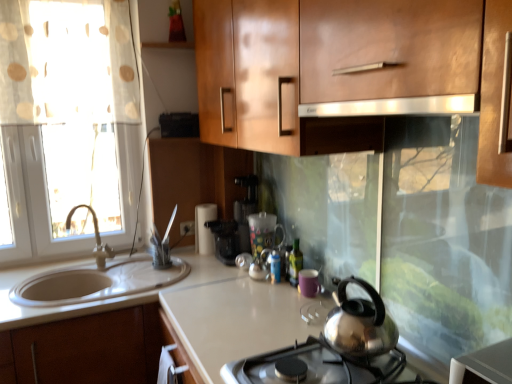
Question: Does matte silver faucet at left have a greater height compared to purple matte mug at center, the 1th appliance viewed from the front?

Choices:
 (A) no
 (B) yes

Answer: (B)

Question: Is matte silver faucet at left smaller than purple matte mug at center, the 1th appliance viewed from the front?

Choices:
 (A) yes
 (B) no

Answer: (B)

Question: Is matte silver faucet at left positioned with its back to purple matte mug at center, placed as the 1th appliance when sorted from right to left?

Choices:
 (A) no
 (B) yes

Answer: (A)

Question: Considering the relative sizes of matte silver faucet at left and purple matte mug at center, the third appliance from the back, in the image provided, is matte silver faucet at left thinner than purple matte mug at center, the third appliance from the back,?

Choices:
 (A) yes
 (B) no

Answer: (B)

Question: Is matte silver faucet at left at the right side of purple matte mug at center, which is the 3th appliance from left to right?

Choices:
 (A) no
 (B) yes

Answer: (A)

Question: Is matte silver faucet at left not close to purple matte mug at center, which is the 3th appliance from left to right?

Choices:
 (A) no
 (B) yes

Answer: (B)

Question: Can you confirm if matte silver faucet at left is thinner than translucent glass mug at center, placed as the second appliance when sorted from left to right?

Choices:
 (A) no
 (B) yes

Answer: (A)

Question: Can you confirm if matte silver faucet at left is positioned to the right of translucent glass mug at center, arranged as the 2th appliance when viewed from the back?

Choices:
 (A) no
 (B) yes

Answer: (A)

Question: Is matte silver faucet at left outside of translucent glass mug at center, placed as the second appliance when sorted from left to right?

Choices:
 (A) yes
 (B) no

Answer: (A)

Question: Does matte silver faucet at left have a lesser height compared to translucent glass mug at center, the second appliance positioned from the right?

Choices:
 (A) yes
 (B) no

Answer: (B)

Question: Could you tell me if matte silver faucet at left is facing translucent glass mug at center, arranged as the 2th appliance when viewed from the front?

Choices:
 (A) yes
 (B) no

Answer: (B)

Question: Is matte silver faucet at left looking in the opposite direction of translucent glass mug at center, arranged as the 2th appliance when viewed from the front?

Choices:
 (A) no
 (B) yes

Answer: (B)

Question: From the image's perspective, is matte silver faucet at left below satin silver exhaust hood at upper center?

Choices:
 (A) yes
 (B) no

Answer: (A)